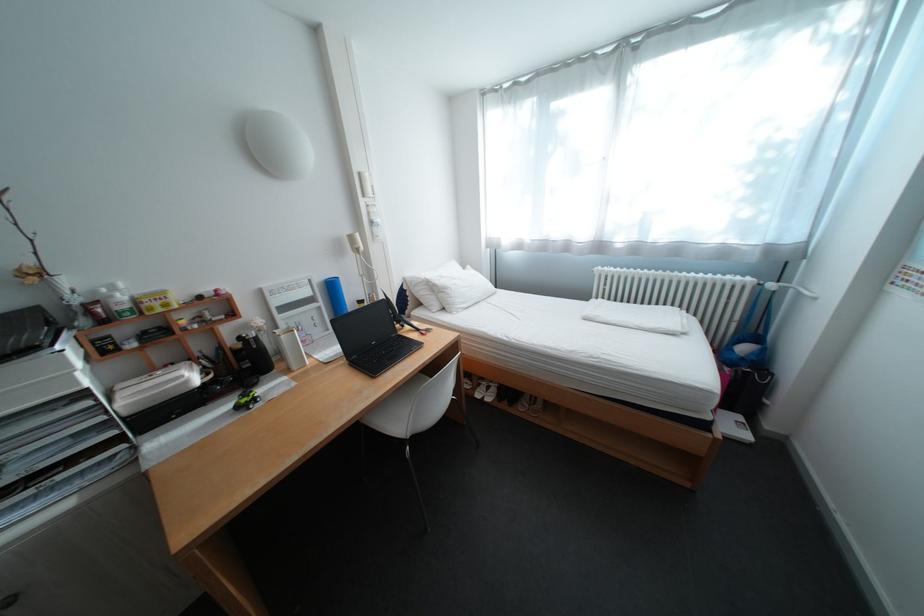
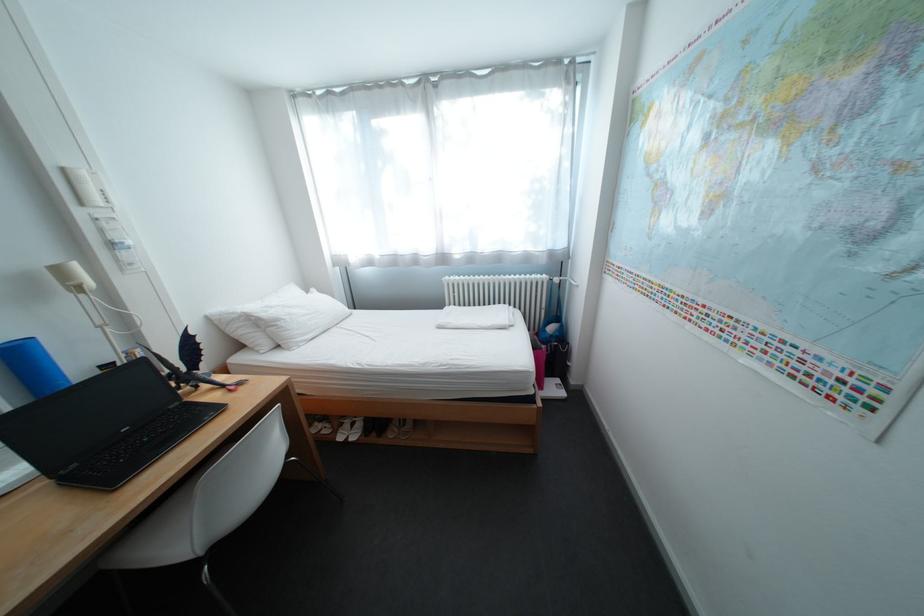
In the second image, find the point that corresponds to (385,344) in the first image.

(137, 431)